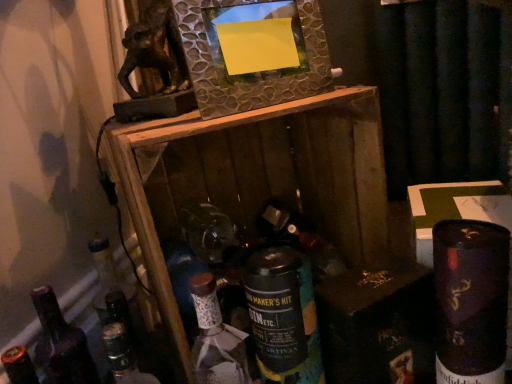
Question: Considering the relative positions of shiny dark blue can at lower right, marked as the 4th bottle in a left-to-right arrangement, and matte glass wine bottle at center in the image provided, is shiny dark blue can at lower right, marked as the 4th bottle in a left-to-right arrangement, to the left or to the right of matte glass wine bottle at center?

Choices:
 (A) right
 (B) left

Answer: (A)

Question: Is shiny dark blue can at lower right, which is the first bottle in right-to-left order, taller or shorter than matte glass wine bottle at center?

Choices:
 (A) tall
 (B) short

Answer: (A)

Question: Considering the real-world distances, which object is farthest from the shiny dark blue can at lower right, marked as the 4th bottle in a left-to-right arrangement?

Choices:
 (A) white ceramic bottle at center, acting as the 3th bottle starting from the right
 (B) matte glass wine bottle at center
 (C) dark brown glass bottle at lower left, positioned as the 4th bottle in right-to-left order
 (D) black matte can at center, the third bottle when ordered from left to right
 (E) metallic textured frame at upper center

Answer: (C)

Question: Which of these objects is positioned closest to the shiny dark blue can at lower right, which is the first bottle in right-to-left order?

Choices:
 (A) matte glass wine bottle at center
 (B) white ceramic bottle at center, which ranks as the second bottle in left-to-right order
 (C) metallic textured frame at upper center
 (D) black matte can at center, the third bottle when ordered from left to right
 (E) dark brown glass bottle at lower left, the 1th bottle when ordered from left to right

Answer: (D)